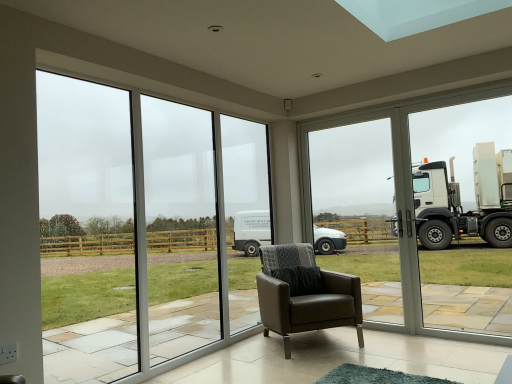
Question: Visually, is clear glass window at right positioned to the left or to the right of transparent glass door at center?

Choices:
 (A) right
 (B) left

Answer: (A)

Question: Considering the positions of clear glass window at right and transparent glass door at center in the image, is clear glass window at right bigger or smaller than transparent glass door at center?

Choices:
 (A) big
 (B) small

Answer: (A)

Question: Which object is positioned closest to the transparent glass door at center?

Choices:
 (A) transparent glass window at left
 (B) clear glass window at right
 (C) brown leather armchair at center

Answer: (B)

Question: Which object is positioned farthest from the brown leather armchair at center?

Choices:
 (A) transparent glass door at center
 (B) transparent glass window at left
 (C) clear glass window at right

Answer: (C)